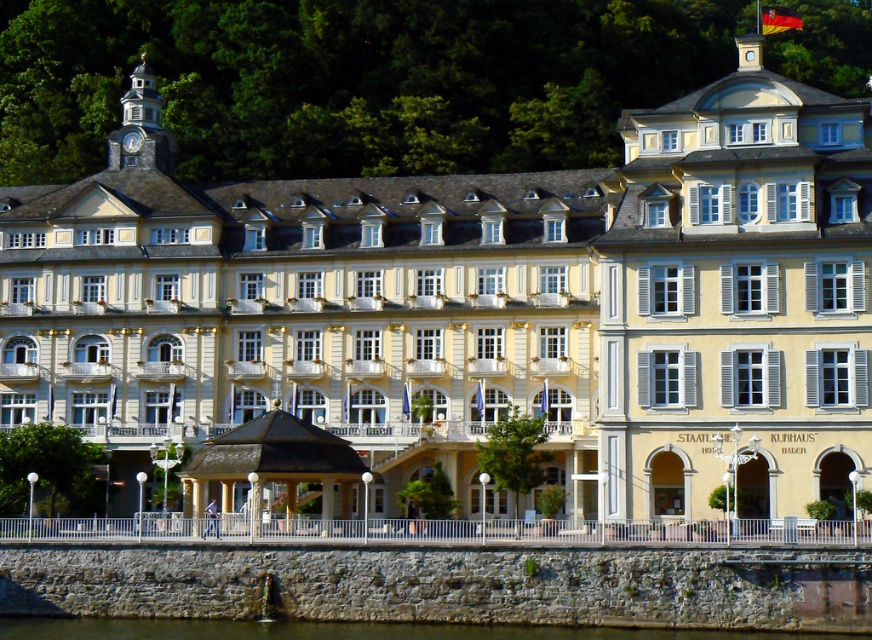
Question: Where is clear water at lower center located in relation to stone clock tower at upper left in the image?

Choices:
 (A) right
 (B) left

Answer: (A)

Question: Which point appears closest to the camera in this image?

Choices:
 (A) (32, 627)
 (B) (151, 156)

Answer: (A)

Question: Which point appears closest to the camera in this image?

Choices:
 (A) (549, 637)
 (B) (134, 100)

Answer: (A)

Question: Is clear water at lower center positioned behind stone clock tower at upper left?

Choices:
 (A) yes
 (B) no

Answer: (B)

Question: From the image, what is the correct spatial relationship of clear water at lower center in relation to stone clock tower at upper left?

Choices:
 (A) left
 (B) right

Answer: (B)